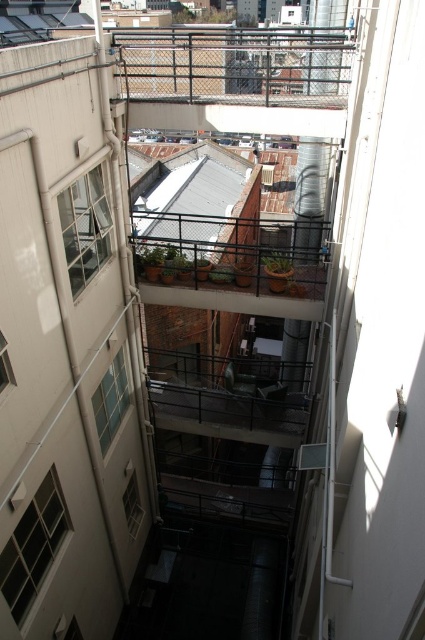
Does metal mesh balcony at center have a lesser width compared to metallic gray balcony at center?

Incorrect, metal mesh balcony at center's width is not less than metallic gray balcony at center's.

Who is more distant from viewer, (161, 257) or (254, 396)?

The point (254, 396) is behind.

At what (x,y) coordinates should I click in order to perform the action: click on metal mesh balcony at center. Please return your answer as a coordinate pair (x, y). Looking at the image, I should click on (232, 272).

Who is more forward, (328,48) or (223,422)?

Point (328,48) is more forward.

Is point (320, 65) positioned in front of point (263, 394)?

Yes, it is.

Locate an element on the screen. black metal fence at upper center is located at coordinates tap(237, 65).

Find the location of a particular element. This screenshot has width=425, height=640. black metal fence at upper center is located at coordinates (237, 65).

Who is positioned more to the left, black metal fence at upper center or metal mesh balcony at center?

From the viewer's perspective, metal mesh balcony at center appears more on the left side.

Is point (319, 58) positioned behind point (218, 301)?

No, it is in front of (218, 301).

Who is more forward, [141,61] or [249,285]?

Point [141,61] is in front.

At what (x,y) coordinates should I click in order to perform the action: click on black metal fence at upper center. Please return your answer as a coordinate pair (x, y). This screenshot has width=425, height=640. Looking at the image, I should click on (237, 65).